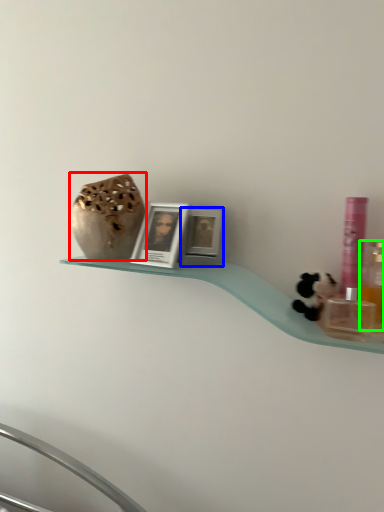
Question: Which object is positioned farthest from vase (highlighted by a red box)? Select from picture frame (highlighted by a blue box) and mouthwash (highlighted by a green box).

Choices:
 (A) picture frame
 (B) mouthwash

Answer: (B)